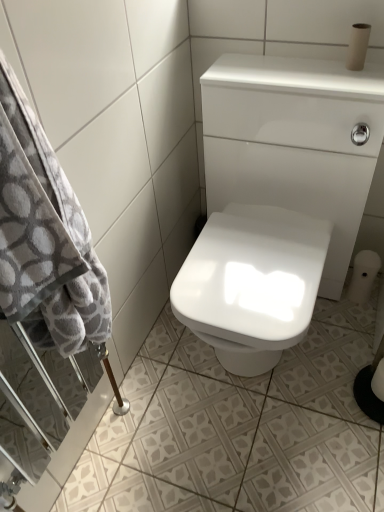
Question: Choose the correct answer: Is gray soft towel at left inside white matte toilet paper at lower right, arranged as the 2th toilet paper when viewed from the front, or outside it?

Choices:
 (A) outside
 (B) inside

Answer: (A)

Question: In terms of size, does gray soft towel at left appear bigger or smaller than white matte toilet paper at lower right, arranged as the 2th toilet paper when viewed from the front?

Choices:
 (A) big
 (B) small

Answer: (A)

Question: Considering the real-world distances, which object is farthest from the white glossy sink at center?

Choices:
 (A) white matte toilet paper at lower right, which is counted as the 3th toilet paper, starting from the top
 (B) gray soft towel at left
 (C) white matte toilet paper at lower right, which is counted as the 1th toilet paper, starting from the back
 (D) matte brown toilet paper at upper right, positioned as the 3th toilet paper in back-to-front order
 (E) white glossy ceramic tile at lower center

Answer: (A)

Question: Estimate the real-world distances between objects in this image. Which object is closer to the white glossy sink at center?

Choices:
 (A) matte brown toilet paper at upper right, the 3th toilet paper in the bottom-to-top sequence
 (B) white matte toilet paper at lower right, which is counted as the 3th toilet paper, starting from the top
 (C) gray soft towel at left
 (D) white glossy ceramic tile at lower center
 (E) white matte toilet paper at lower right, which is counted as the 1th toilet paper, starting from the back

Answer: (A)